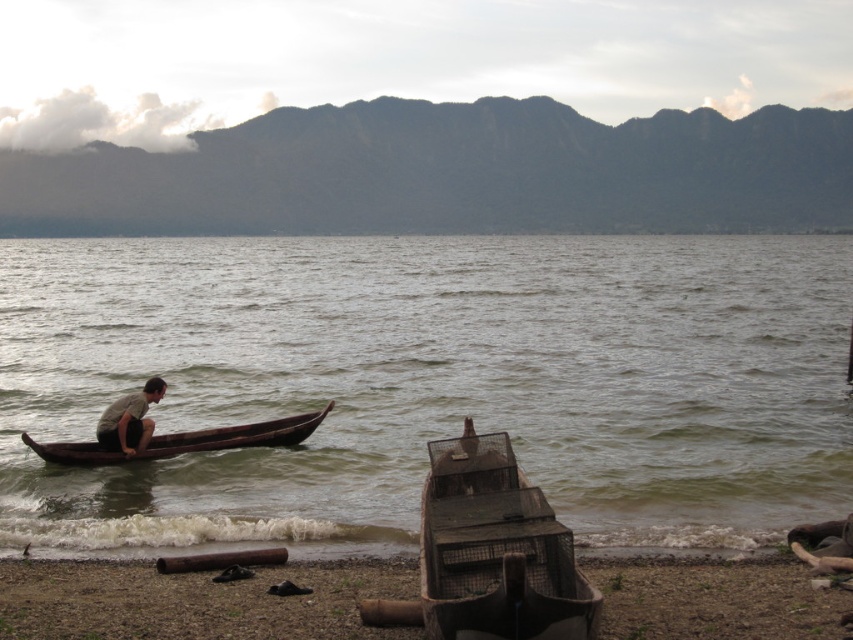
You are planning to dock your small boat at the lakeside shown in the image. You notice the brown wooden water at center and the rusty metal boat at lower center. Which of these two objects has a wider width, making it a better candidate for anchoring your boat?

The brown wooden water at center has a larger width than the rusty metal boat at lower center, so it would be a better candidate for anchoring your boat.

You are standing at the point marked as point (430, 381) in the image. What type of surface are you currently standing on?

You are standing on brown wooden water at center.